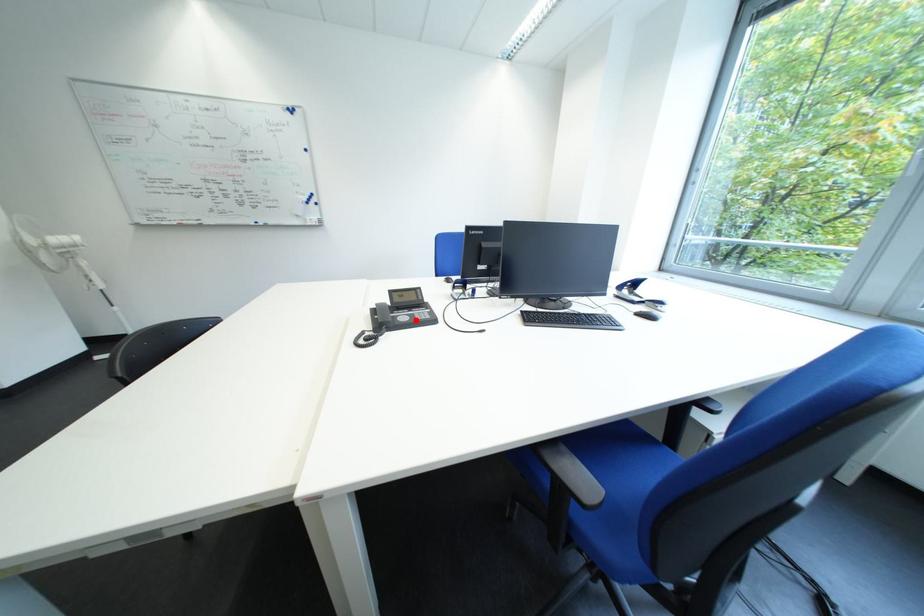
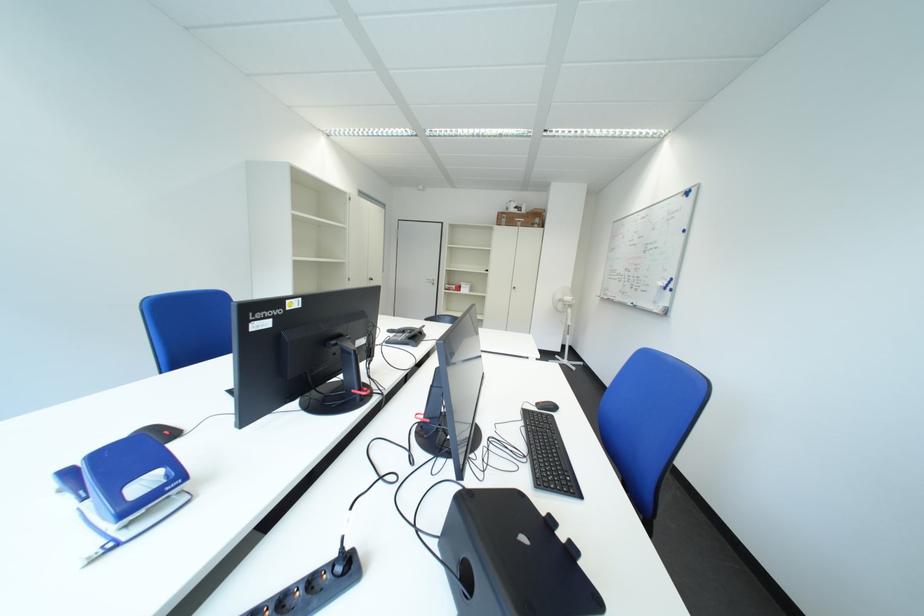
In the second image, find the point that corresponds to the highlighted location in the first image.

(411, 336)